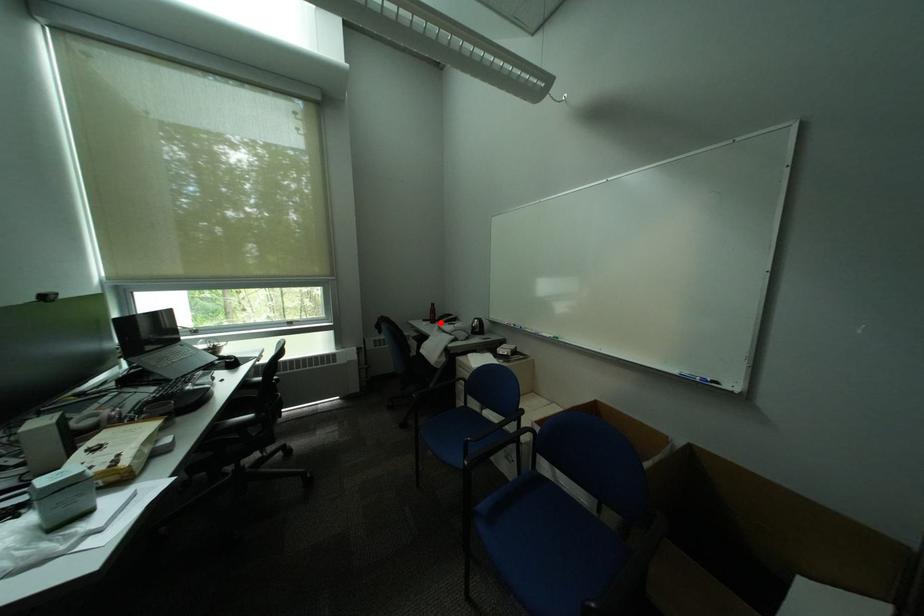
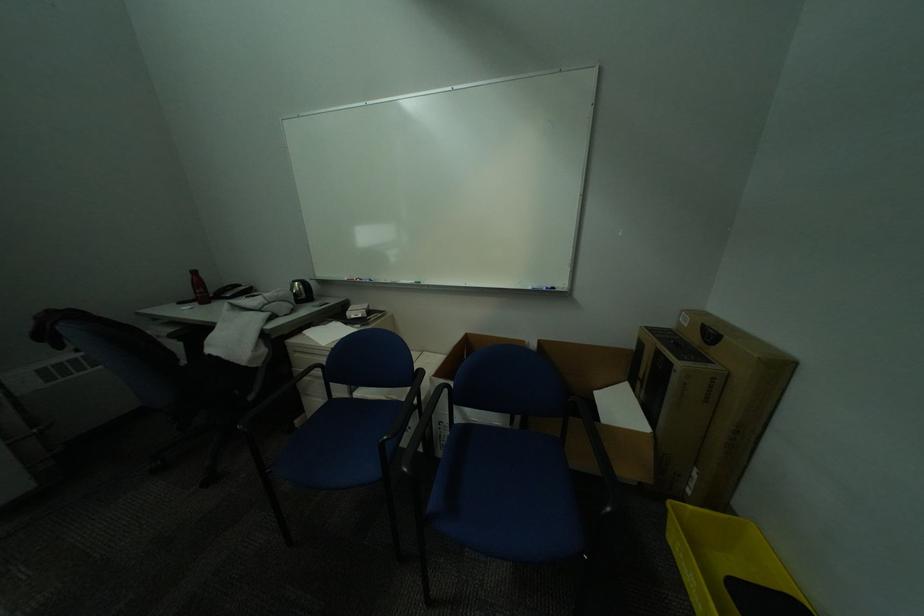
Question: I am providing you with two images of the same scene from different viewpoints. Image1 has a red point marked. In image2, the corresponding 3D location appears at what relative position? Reply with the corresponding letter.

Choices:
 (A) Closer
 (B) Farther

Answer: (B)